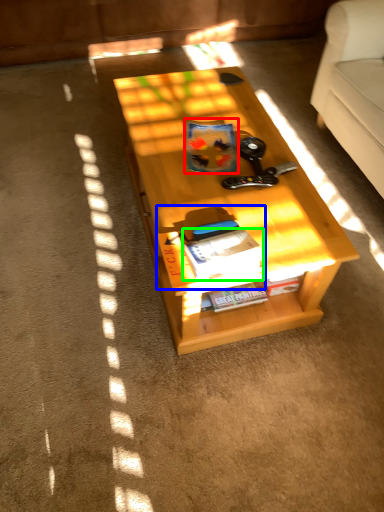
Question: Estimate the real-world distances between objects in this image. Which object is closer to book (highlighted by a red box), book (highlighted by a blue box) or magazine (highlighted by a green box)?

Choices:
 (A) book
 (B) magazine

Answer: (A)